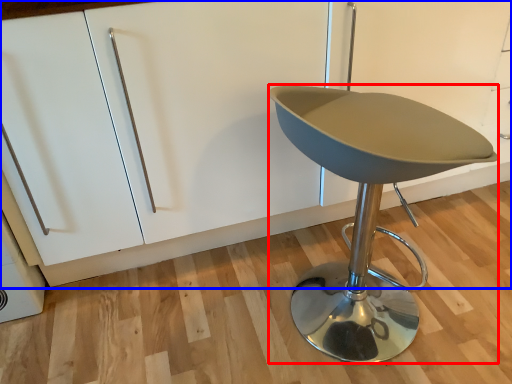
Question: Among these objects, which one is farthest to the camera, furniture (highlighted by a red box) or cabinetry (highlighted by a blue box)?

Choices:
 (A) furniture
 (B) cabinetry

Answer: (B)